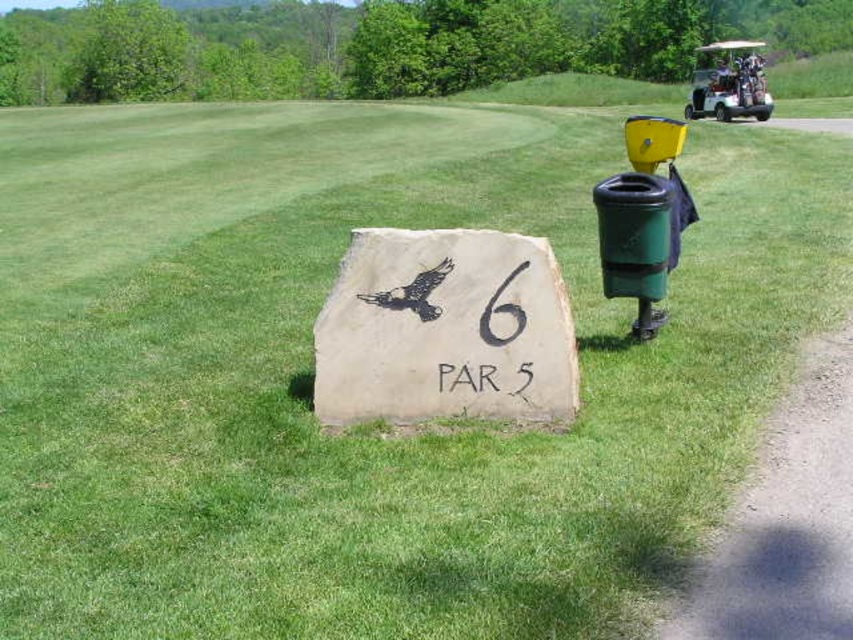
You are a golfer who needs to walk from the natural stone sign at center to the metallic silver golf cart at upper right. How far will you have to walk in meters?

The natural stone sign at center and metallic silver golf cart at upper right are 22.01 meters apart, so you will have to walk 22.01 meters.

You are a golfer standing at the sixth hole, which is marked by the natural stone sign at center. You want to catch up with your friend who is driving the metallic silver golf cart at upper right. Which direction should you head to move towards the golf cart?

The natural stone sign at center is located below the metallic silver golf cart at upper right, so you should head upwards to move towards the golf cart.

You are a golfer standing near the natural stone sign at center and want to place your golf clubs on the metallic silver golf cart at upper right. Can you fit all your clubs on the cart without exceeding its space?

The natural stone sign at center is smaller than the metallic silver golf cart at upper right, so yes, you can fit all your clubs on the metallic silver golf cart at upper right since it has more space.